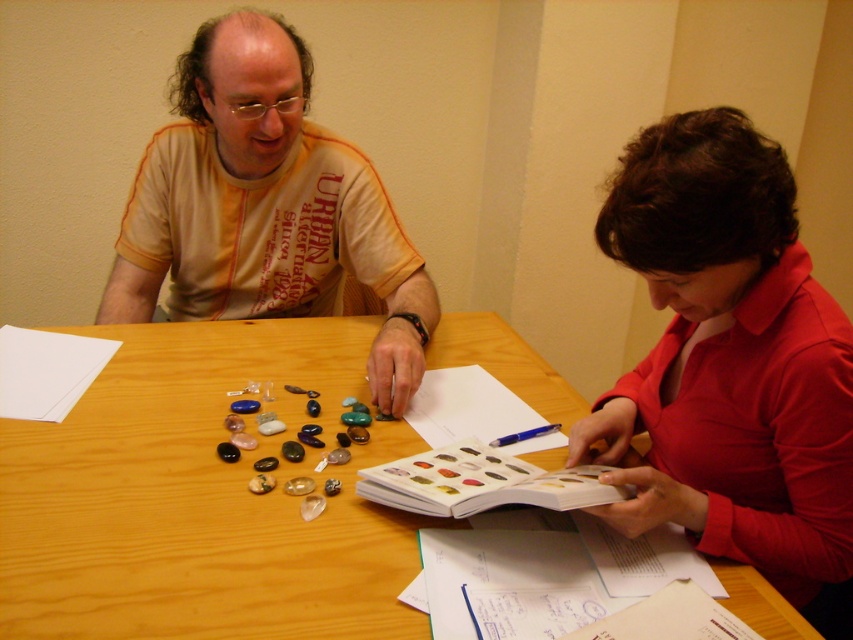
Question: Does wooden table at center have a larger size compared to matte red blouse at center?

Choices:
 (A) yes
 (B) no

Answer: (A)

Question: Which of the following is the farthest from the observer?

Choices:
 (A) (64, 353)
 (B) (376, 496)

Answer: (A)

Question: Which point appears closest to the camera in this image?

Choices:
 (A) (422, 385)
 (B) (229, 118)

Answer: (A)

Question: Considering the relative positions of shiny plastic book at center and blue plastic pen at lower center in the image provided, where is shiny plastic book at center located with respect to blue plastic pen at lower center?

Choices:
 (A) above
 (B) below

Answer: (B)

Question: Estimate the real-world distances between objects in this image. Which object is closer to the white paper at center?

Choices:
 (A) matte red blouse at center
 (B) wooden table at center

Answer: (B)

Question: Is wooden table at center further to the viewer compared to matte orange t-shirt at center?

Choices:
 (A) no
 (B) yes

Answer: (A)